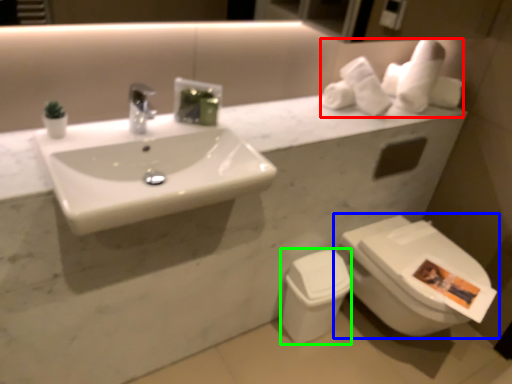
Question: Considering the real-world distances, which object is closest to toilet paper (highlighted by a red box)? toilet (highlighted by a blue box) or toilet bowl (highlighted by a green box).

Choices:
 (A) toilet
 (B) toilet bowl

Answer: (A)